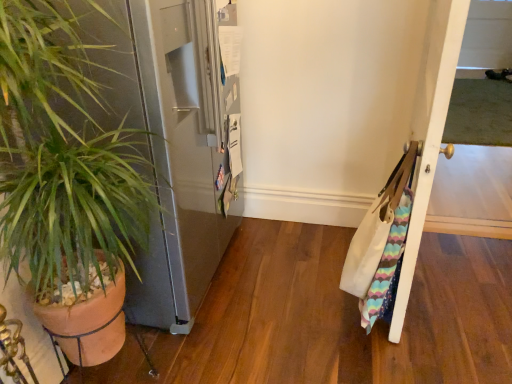
Question: Could green leafy plant in terracotta pot at left be considered to be inside white wood door at right?

Choices:
 (A) no
 (B) yes

Answer: (A)

Question: Are white wood door at right and green leafy plant in terracotta pot at left making contact?

Choices:
 (A) no
 (B) yes

Answer: (A)

Question: Is white wood door at right positioned with its back to green leafy plant in terracotta pot at left?

Choices:
 (A) no
 (B) yes

Answer: (A)

Question: From the image's perspective, does white wood door at right appear lower than green leafy plant in terracotta pot at left?

Choices:
 (A) no
 (B) yes

Answer: (A)

Question: Is white wood door at right aimed at green leafy plant in terracotta pot at left?

Choices:
 (A) no
 (B) yes

Answer: (A)

Question: Is the depth of white wood door at right greater than that of green leafy plant in terracotta pot at left?

Choices:
 (A) no
 (B) yes

Answer: (B)

Question: Considering the relative positions of green leafy plant in terracotta pot at left and white wood door at right in the image provided, is green leafy plant in terracotta pot at left to the right of white wood door at right from the viewer's perspective?

Choices:
 (A) yes
 (B) no

Answer: (B)

Question: Is white wood door at right located within green leafy plant in terracotta pot at left?

Choices:
 (A) no
 (B) yes

Answer: (A)

Question: Would you say green leafy plant in terracotta pot at left is a long distance from white wood door at right?

Choices:
 (A) no
 (B) yes

Answer: (B)

Question: Is green leafy plant in terracotta pot at left to the left of white wood door at right from the viewer's perspective?

Choices:
 (A) yes
 (B) no

Answer: (A)

Question: Is green leafy plant in terracotta pot at left completely or partially outside of white wood door at right?

Choices:
 (A) yes
 (B) no

Answer: (A)

Question: Can you confirm if green leafy plant in terracotta pot at left is smaller than white wood door at right?

Choices:
 (A) no
 (B) yes

Answer: (A)

Question: Is white wood door at right in front of or behind green leafy plant in terracotta pot at left in the image?

Choices:
 (A) behind
 (B) front

Answer: (A)